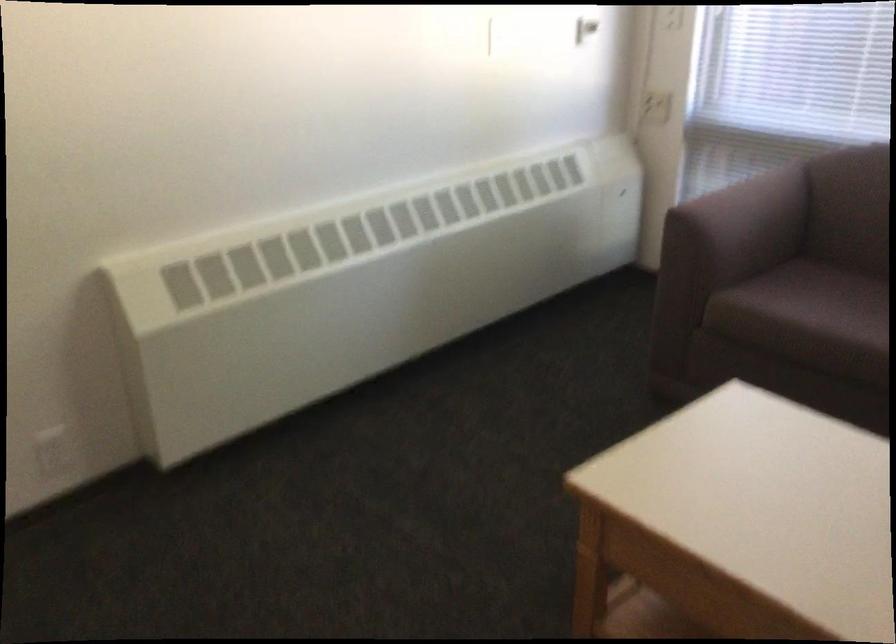
Describe the element at coordinates (807, 303) in the screenshot. I see `a brown chair sitting surface` at that location.